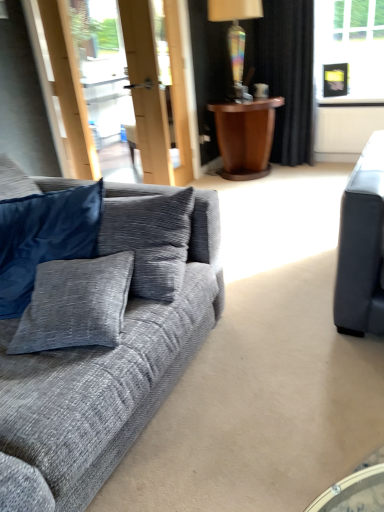
Question: Looking at the image, does textured gray couch at left seem bigger or smaller compared to rainbow glass lamp at upper center?

Choices:
 (A) big
 (B) small

Answer: (A)

Question: From their relative heights in the image, would you say textured gray couch at left is taller or shorter than rainbow glass lamp at upper center?

Choices:
 (A) short
 (B) tall

Answer: (B)

Question: Based on their relative distances, which object is farther from the rainbow glass lamp at upper center?

Choices:
 (A) brown wooden side table at upper center
 (B) velvet blue pillow at left
 (C) textured gray couch at left
 (D) black velvet curtain at upper right

Answer: (C)

Question: Based on their relative distances, which object is nearer to the brown wooden side table at upper center?

Choices:
 (A) textured gray couch at left
 (B) velvet blue pillow at left
 (C) black velvet curtain at upper right
 (D) rainbow glass lamp at upper center

Answer: (D)